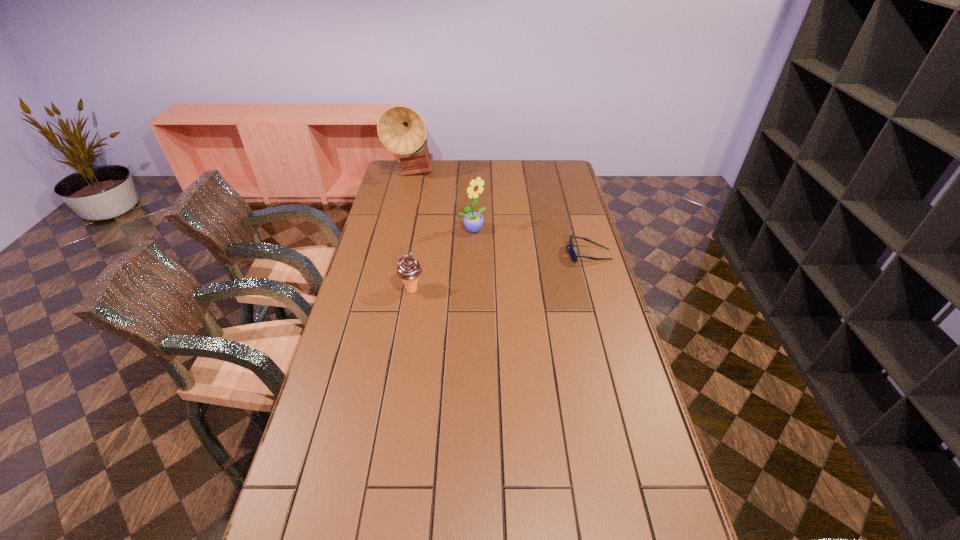
I want to click on object located in the right edge section of the desktop, so click(x=573, y=254).

This screenshot has width=960, height=540. What are the coordinates of `object present at the far left corner` in the screenshot? It's located at (401, 129).

At what (x,y) coordinates should I click in order to perform the action: click on vacant space at the far edge of the desktop. Please return your answer as a coordinate pair (x, y). Image resolution: width=960 pixels, height=540 pixels. Looking at the image, I should click on (452, 178).

Where is `vacant area at the left edge of the desktop`? The width and height of the screenshot is (960, 540). vacant area at the left edge of the desktop is located at coordinates (321, 451).

This screenshot has height=540, width=960. In the image, there is a desktop. In order to click on vacant space at the right edge in this screenshot , I will do `click(636, 392)`.

At what (x,y) coordinates should I click in order to perform the action: click on free space at the far left corner of the desktop. Please return your answer as a coordinate pair (x, y). Looking at the image, I should click on (409, 179).

Locate an element on the screen. The height and width of the screenshot is (540, 960). vacant area at the far right corner of the desktop is located at coordinates (566, 165).

Image resolution: width=960 pixels, height=540 pixels. I want to click on free space between the nearest object and the tallest object, so click(x=412, y=231).

The width and height of the screenshot is (960, 540). I want to click on blank region between the tallest object and the rightmost object, so click(x=500, y=213).

Where is `free space between the icecream and the third shortest object`? free space between the icecream and the third shortest object is located at coordinates (443, 260).